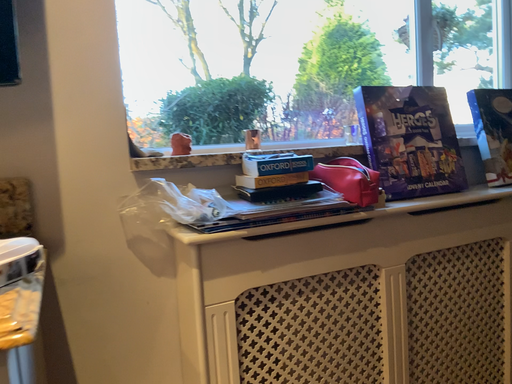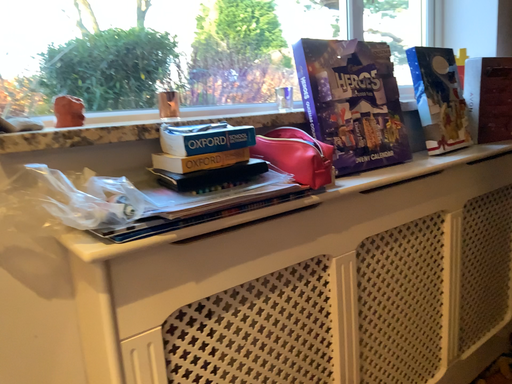
Question: Which way did the camera rotate in the video?

Choices:
 (A) rotated left
 (B) rotated right

Answer: (B)